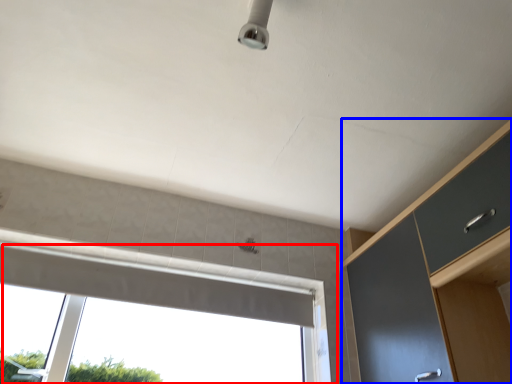
Question: Which point is closer to the camera, window (highlighted by a red box) or dresser (highlighted by a blue box)?

Choices:
 (A) window
 (B) dresser

Answer: (B)